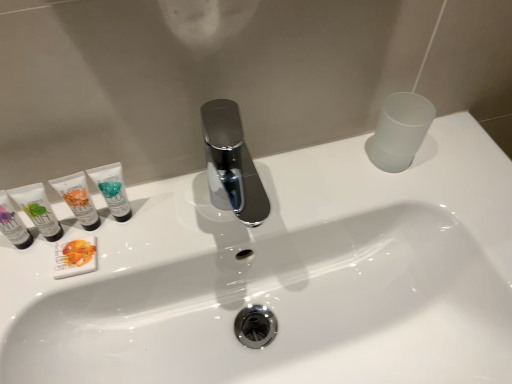
Locate an element on the screen. The width and height of the screenshot is (512, 384). white glossy sink at center is located at coordinates (286, 276).

At what (x,y) coordinates should I click in order to perform the action: click on matte white tube at left, which is counted as the second toiletry, starting from the left. Please return your answer as a coordinate pair (x, y). Looking at the image, I should click on (38, 210).

From the image's perspective, count 2nd toiletrys downward from the matte white tube at left, which is counted as the second toiletry, starting from the left, and point to it. Please provide its 2D coordinates.

[(75, 257)]

From the picture: Considering the positions of objects matte white tube at left, the 4th toiletry from the right, and white matte soap bar at left, the third toiletry positioned from the right, in the image provided, who is more to the right, matte white tube at left, the 4th toiletry from the right, or white matte soap bar at left, the third toiletry positioned from the right,?

white matte soap bar at left, the third toiletry positioned from the right, is more to the right.

Does point (44, 195) lie behind point (67, 249)?

That is False.

Is the surface of matte white tube at left, the 4th toiletry from the right, in direct contact with white matte soap bar at left, the 3th toiletry from the left?

Absolutely, matte white tube at left, the 4th toiletry from the right, is next to and touching white matte soap bar at left, the 3th toiletry from the left.

Which of these two, white matte soap bar at left, the 3th toiletry from the left, or matte white tube at left, the fifth toiletry in the right-to-left sequence, is smaller?

white matte soap bar at left, the 3th toiletry from the left.

Is white matte soap bar at left, the 3th toiletry from the left, thinner than matte white tube at left, the fifth toiletry in the right-to-left sequence?

No, white matte soap bar at left, the 3th toiletry from the left, is not thinner than matte white tube at left, the fifth toiletry in the right-to-left sequence.

Measure the distance between white matte soap bar at left, the 3th toiletry from the left, and matte white tube at left, which is the 1th toiletry from left to right.

white matte soap bar at left, the 3th toiletry from the left, and matte white tube at left, which is the 1th toiletry from left to right, are 2.44 inches apart from each other.

Are white matte soap bar at left, the third toiletry positioned from the right, and matte white tube at left, the fifth toiletry in the right-to-left sequence, far apart?

That's not correct — white matte soap bar at left, the third toiletry positioned from the right, is a little close to matte white tube at left, the fifth toiletry in the right-to-left sequence.

Is white matte tube at left, the second toiletry from the right, beside matte white tube at left, which is the 1th toiletry from left to right?

Yes, white matte tube at left, the second toiletry from the right, is beside matte white tube at left, which is the 1th toiletry from left to right.

From a real-world perspective, is white matte tube at left, the second toiletry from the right, on top of matte white tube at left, the fifth toiletry in the right-to-left sequence?

Indeed, from a real-world perspective, white matte tube at left, the second toiletry from the right, stands above matte white tube at left, the fifth toiletry in the right-to-left sequence.

Which object is positioned more to the left, white matte tube at left, the 4th toiletry positioned from the left, or matte white tube at left, the fifth toiletry in the right-to-left sequence?

matte white tube at left, the fifth toiletry in the right-to-left sequence, is more to the left.

Considering the positions of objects white matte tube at left, the second toiletry from the right, and matte white tube at left, the fifth toiletry in the right-to-left sequence, in the image provided, who is in front, white matte tube at left, the second toiletry from the right, or matte white tube at left, the fifth toiletry in the right-to-left sequence,?

matte white tube at left, the fifth toiletry in the right-to-left sequence, is in front.

Considering the relative sizes of white matte tube at left, the 4th toiletry positioned from the left, and matte white tube at left, the 4th toiletry from the right, in the image provided, is white matte tube at left, the 4th toiletry positioned from the left, thinner than matte white tube at left, the 4th toiletry from the right,?

No.

Considering the relative positions of white matte tube at left, the second toiletry from the right, and matte white tube at left, which is counted as the second toiletry, starting from the left, in the image provided, is white matte tube at left, the second toiletry from the right, to the left of matte white tube at left, which is counted as the second toiletry, starting from the left, from the viewer's perspective?

In fact, white matte tube at left, the second toiletry from the right, is to the right of matte white tube at left, which is counted as the second toiletry, starting from the left.

Is white matte tube at left, the second toiletry from the right, in contact with matte white tube at left, which is counted as the second toiletry, starting from the left?

Yes, white matte tube at left, the second toiletry from the right, is beside matte white tube at left, which is counted as the second toiletry, starting from the left.

In the scene shown: Considering the positions of objects white matte tube at left, the 4th toiletry positioned from the left, and matte white tube at left, the 4th toiletry from the right, in the image provided, who is in front, white matte tube at left, the 4th toiletry positioned from the left, or matte white tube at left, the 4th toiletry from the right,?

matte white tube at left, the 4th toiletry from the right, is in front.

Could you tell me if white matte soap bar at left, the third toiletry positioned from the right, is facing teal matte tube at left, arranged as the 5th toiletry when viewed from the left?

No, white matte soap bar at left, the third toiletry positioned from the right, does not turn towards teal matte tube at left, arranged as the 5th toiletry when viewed from the left.

From a real-world perspective, who is located lower, white matte soap bar at left, the 3th toiletry from the left, or teal matte tube at left, arranged as the 5th toiletry when viewed from the left?

white matte soap bar at left, the 3th toiletry from the left, from a real-world perspective.

Which object is further away from the camera taking this photo, white matte soap bar at left, the third toiletry positioned from the right, or teal matte tube at left, arranged as the 5th toiletry when viewed from the left?

white matte soap bar at left, the third toiletry positioned from the right.

Locate an element on the screen. The height and width of the screenshot is (384, 512). toiletry that is the 4th one above the white matte soap bar at left, the 3th toiletry from the left (from a real-world perspective) is located at coordinates (112, 189).

Is there a large distance between white glossy sink at center and matte white tube at left, the 4th toiletry from the right?

They are positioned close to each other.

In the scene shown: Is white glossy sink at center further to camera compared to matte white tube at left, which is counted as the second toiletry, starting from the left?

No.

Considering the sizes of objects white glossy sink at center and matte white tube at left, which is counted as the second toiletry, starting from the left, in the image provided, who is smaller, white glossy sink at center or matte white tube at left, which is counted as the second toiletry, starting from the left,?

matte white tube at left, which is counted as the second toiletry, starting from the left.

Where is `toiletry that is the 4th one when counting leftward from the white glossy sink at center`? The height and width of the screenshot is (384, 512). toiletry that is the 4th one when counting leftward from the white glossy sink at center is located at coordinates (38, 210).

From the image's perspective, is white matte soap bar at left, the third toiletry positioned from the right, above matte white tube at left, which is counted as the second toiletry, starting from the left?

No, from the image's perspective, white matte soap bar at left, the third toiletry positioned from the right, is not over matte white tube at left, which is counted as the second toiletry, starting from the left.

Can you confirm if white matte soap bar at left, the 3th toiletry from the left, is smaller than matte white tube at left, the 4th toiletry from the right?

Correct, white matte soap bar at left, the 3th toiletry from the left, occupies less space than matte white tube at left, the 4th toiletry from the right.

In the scene shown: Who is more distant, white matte soap bar at left, the third toiletry positioned from the right, or matte white tube at left, which is counted as the second toiletry, starting from the left?

white matte soap bar at left, the third toiletry positioned from the right.

Which point is more forward, (68, 262) or (41, 213)?

The point (68, 262) is in front.

What are the coordinates of `the 1st toiletry counting from the right of the matte white tube at left, the 4th toiletry from the right` in the screenshot? It's located at (75, 257).

Where is `the 1st toiletry above the white matte soap bar at left, the 3th toiletry from the left (from the image's perspective)`? The image size is (512, 384). the 1st toiletry above the white matte soap bar at left, the 3th toiletry from the left (from the image's perspective) is located at coordinates (13, 224).

Which object lies further to the anchor point teal matte tube at left, arranged as the 5th toiletry when viewed from the left, matte white tube at left, the 4th toiletry from the right, or matte white tube at left, the fifth toiletry in the right-to-left sequence?

Among the two, matte white tube at left, the fifth toiletry in the right-to-left sequence, is located further to teal matte tube at left, arranged as the 5th toiletry when viewed from the left.

Considering their positions, is white matte soap bar at left, the 3th toiletry from the left, positioned further to white glossy sink at center than teal matte tube at left, arranged as the 5th toiletry when viewed from the left?

white matte soap bar at left, the 3th toiletry from the left, lies further to white glossy sink at center than the other object.

Based on their spatial positions, is white glossy sink at center or white matte tube at left, the 4th toiletry positioned from the left, further from matte white tube at left, the 4th toiletry from the right?

white glossy sink at center.

When comparing their distances from matte white tube at left, which is counted as the second toiletry, starting from the left, does teal matte tube at left, arranged as the 5th toiletry when viewed from the left, or white matte tube at left, the second toiletry from the right, seem closer?

white matte tube at left, the second toiletry from the right, is closer to matte white tube at left, which is counted as the second toiletry, starting from the left.

Which object lies further to the anchor point white matte soap bar at left, the 3th toiletry from the left, matte white tube at left, the fifth toiletry in the right-to-left sequence, or teal matte tube at left, arranged as the 5th toiletry when viewed from the left?

The object further to white matte soap bar at left, the 3th toiletry from the left, is teal matte tube at left, arranged as the 5th toiletry when viewed from the left.

When comparing their distances from white matte tube at left, the second toiletry from the right, does white glossy sink at center or teal matte tube at left, arranged as the 5th toiletry when viewed from the left, seem closer?

teal matte tube at left, arranged as the 5th toiletry when viewed from the left, lies closer to white matte tube at left, the second toiletry from the right, than the other object.

Estimate the real-world distances between objects in this image. Which object is closer to matte white tube at left, the 4th toiletry from the right, white matte soap bar at left, the third toiletry positioned from the right, or teal matte tube at left, arranged as the 5th toiletry when viewed from the left?

The object closer to matte white tube at left, the 4th toiletry from the right, is white matte soap bar at left, the third toiletry positioned from the right.

Based on their spatial positions, is white glossy sink at center or matte white tube at left, the fifth toiletry in the right-to-left sequence, further from teal matte tube at left, the first toiletry when ordered from right to left?

white glossy sink at center lies further to teal matte tube at left, the first toiletry when ordered from right to left, than the other object.

In order to click on toiletry between white matte tube at left, the second toiletry from the right, and white glossy sink at center from left to right in this screenshot , I will do `click(112, 189)`.

Image resolution: width=512 pixels, height=384 pixels. What are the coordinates of `toiletry situated between matte white tube at left, which is the 1th toiletry from left to right, and white matte soap bar at left, the third toiletry positioned from the right, from left to right` in the screenshot? It's located at (38, 210).